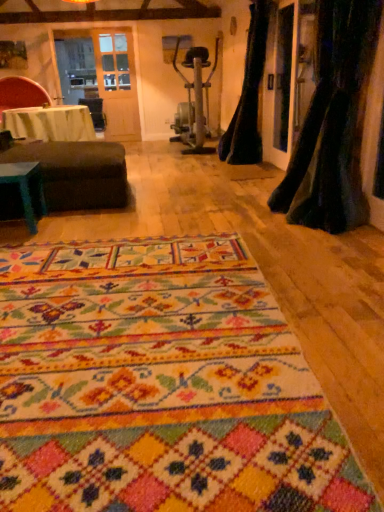
What is the approximate width of multicolored woven rug at center?

The width of multicolored woven rug at center is 7.50 feet.

Describe the element at coordinates (77, 173) in the screenshot. I see `dark brown fabric ottoman at left` at that location.

In the scene shown: What is the approximate width of velvet red chair at upper left?

velvet red chair at upper left is 36.25 inches wide.

Where is `velvet red chair at upper left`? velvet red chair at upper left is located at coordinates (21, 94).

The image size is (384, 512). I want to click on multicolored woven rug at center, so click(160, 388).

Is black velvet curtain at right, which is counted as the first curtain, starting from the front, positioned with its back to velvet red chair at upper left?

No.

Would you say black velvet curtain at right, which is the second curtain from back to front, contains velvet red chair at upper left?

That's incorrect, velvet red chair at upper left is not inside black velvet curtain at right, which is the second curtain from back to front.

From a real-world perspective, who is located lower, black velvet curtain at right, which is counted as the first curtain, starting from the front, or velvet red chair at upper left?

velvet red chair at upper left.

Which is more to the left, velvet red chair at upper left or multicolored woven rug at center?

velvet red chair at upper left.

Is velvet red chair at upper left with multicolored woven rug at center?

No, velvet red chair at upper left is not with multicolored woven rug at center.

Find the location of `chair positioned vertically above the multicolored woven rug at center (from a real-world perspective)`. chair positioned vertically above the multicolored woven rug at center (from a real-world perspective) is located at coordinates (21, 94).

Would you say velvet red chair at upper left is inside or outside multicolored woven rug at center?

velvet red chair at upper left lies outside multicolored woven rug at center.

From a real-world perspective, is white cloth-covered table at left, the 2th table when ordered from bottom to top, above or below dark brown fabric ottoman at left?

Clearly, from a real-world perspective, white cloth-covered table at left, the 2th table when ordered from bottom to top, is above dark brown fabric ottoman at left.

Considering the relative sizes of white cloth-covered table at left, acting as the 2th table starting from the front, and dark brown fabric ottoman at left in the image provided, is white cloth-covered table at left, acting as the 2th table starting from the front, bigger than dark brown fabric ottoman at left?

Correct, white cloth-covered table at left, acting as the 2th table starting from the front, is larger in size than dark brown fabric ottoman at left.

Which is further, (20,116) or (32,150)?

The point (20,116) is behind.

From the picture: Is velvet black curtain at right, which is the 2th curtain from front to back, looking in the opposite direction of multicolored woven rug at center?

velvet black curtain at right, which is the 2th curtain from front to back, is not turned away from multicolored woven rug at center.

From the image's perspective, which one is positioned lower, velvet black curtain at right, which is the 2th curtain from front to back, or multicolored woven rug at center?

multicolored woven rug at center appears lower in the image.

Which object is thinner, velvet black curtain at right, placed as the 1th curtain when sorted from back to front, or multicolored woven rug at center?

Thinner between the two is velvet black curtain at right, placed as the 1th curtain when sorted from back to front.

Is velvet black curtain at right, which is the 2th curtain from front to back, next to multicolored woven rug at center?

velvet black curtain at right, which is the 2th curtain from front to back, is not next to multicolored woven rug at center, and they're not touching.

Between velvet red chair at upper left and black velvet curtain at right, which is the second curtain from back to front, which one is positioned in front?

black velvet curtain at right, which is the second curtain from back to front.

From a real-world perspective, is velvet red chair at upper left located beneath black velvet curtain at right, which is the second curtain from back to front?

Indeed, from a real-world perspective, velvet red chair at upper left is positioned beneath black velvet curtain at right, which is the second curtain from back to front.

Considering the relative positions of velvet red chair at upper left and black velvet curtain at right, which is counted as the first curtain, starting from the front, in the image provided, is velvet red chair at upper left to the left or to the right of black velvet curtain at right, which is counted as the first curtain, starting from the front,?

In the image, velvet red chair at upper left appears on the left side of black velvet curtain at right, which is counted as the first curtain, starting from the front.

Is point (37, 97) closer to camera compared to point (319, 81)?

That is False.

From their relative heights in the image, would you say dark brown fabric ottoman at left is taller or shorter than velvet black curtain at right, placed as the 1th curtain when sorted from back to front?

In the image, dark brown fabric ottoman at left appears to be shorter than velvet black curtain at right, placed as the 1th curtain when sorted from back to front.

Is dark brown fabric ottoman at left facing towards velvet black curtain at right, placed as the 1th curtain when sorted from back to front?

No, dark brown fabric ottoman at left is not oriented towards velvet black curtain at right, placed as the 1th curtain when sorted from back to front.

Is dark brown fabric ottoman at left beside velvet black curtain at right, placed as the 1th curtain when sorted from back to front?

No.

Based on the photo, considering the positions of objects dark brown fabric ottoman at left and velvet black curtain at right, placed as the 1th curtain when sorted from back to front, in the image provided, who is more to the left, dark brown fabric ottoman at left or velvet black curtain at right, placed as the 1th curtain when sorted from back to front,?

dark brown fabric ottoman at left is more to the left.

Considering the sizes of objects velvet black curtain at right, placed as the 1th curtain when sorted from back to front, and white cloth-covered table at left, which ranks as the 1th table in back-to-front order, in the image provided, who is smaller, velvet black curtain at right, placed as the 1th curtain when sorted from back to front, or white cloth-covered table at left, which ranks as the 1th table in back-to-front order,?

white cloth-covered table at left, which ranks as the 1th table in back-to-front order.

In terms of height, does velvet black curtain at right, placed as the 1th curtain when sorted from back to front, look taller or shorter compared to white cloth-covered table at left, acting as the 2th table starting from the front?

velvet black curtain at right, placed as the 1th curtain when sorted from back to front, is taller than white cloth-covered table at left, acting as the 2th table starting from the front.

What's the angular difference between velvet black curtain at right, which is the 2th curtain from front to back, and white cloth-covered table at left, which is the 1th table from top to bottom,'s facing directions?

There is a 179-degree angle between the facing directions of velvet black curtain at right, which is the 2th curtain from front to back, and white cloth-covered table at left, which is the 1th table from top to bottom.

Where is `chair that is behind the black velvet curtain at right, which is the second curtain from back to front`? chair that is behind the black velvet curtain at right, which is the second curtain from back to front is located at coordinates (21, 94).

Find the location of a particular element. mat below the velvet red chair at upper left (from the image's perspective) is located at coordinates (160, 388).

Based on their spatial positions, is multicolored woven rug at center or velvet black curtain at right, which is the 2th curtain from front to back, closer to white cloth-covered table at left, which is the 1th table from top to bottom?

velvet black curtain at right, which is the 2th curtain from front to back, is closer to white cloth-covered table at left, which is the 1th table from top to bottom.

Considering their positions, is white cloth-covered table at left, acting as the 2th table starting from the front, positioned closer to velvet black curtain at right, placed as the 1th curtain when sorted from back to front, than black velvet curtain at right, which is counted as the first curtain, starting from the front?

The object closer to velvet black curtain at right, placed as the 1th curtain when sorted from back to front, is black velvet curtain at right, which is counted as the first curtain, starting from the front.

When comparing their distances from dark brown fabric ottoman at left, does white cloth-covered table at left, which is the 1th table from top to bottom, or velvet red chair at upper left seem further?

The object further to dark brown fabric ottoman at left is velvet red chair at upper left.

Estimate the real-world distances between objects in this image. Which object is closer to green felt table at left, placed as the 2th table when sorted from back to front, multicolored woven rug at center or white cloth-covered table at left, which is the 1th table from top to bottom?

multicolored woven rug at center is positioned closer to the anchor green felt table at left, placed as the 2th table when sorted from back to front.

Considering their positions, is velvet red chair at upper left positioned further to dark brown fabric ottoman at left than black velvet curtain at right, which is the second curtain from back to front?

velvet red chair at upper left is positioned further to the anchor dark brown fabric ottoman at left.

Considering their positions, is multicolored woven rug at center positioned further to dark brown fabric ottoman at left than velvet red chair at upper left?

Among the two, velvet red chair at upper left is located further to dark brown fabric ottoman at left.

Looking at the image, which one is located further to multicolored woven rug at center, green felt table at left, placed as the 2th table when sorted from back to front, or velvet black curtain at right, placed as the 1th curtain when sorted from back to front?

The object further to multicolored woven rug at center is velvet black curtain at right, placed as the 1th curtain when sorted from back to front.

Estimate the real-world distances between objects in this image. Which object is closer to white cloth-covered table at left, which is the 1th table from top to bottom, black velvet curtain at right, which is the second curtain from back to front, or dark brown fabric ottoman at left?

dark brown fabric ottoman at left is positioned closer to the anchor white cloth-covered table at left, which is the 1th table from top to bottom.

I want to click on table located between multicolored woven rug at center and velvet black curtain at right, which is the 2th curtain from front to back, in the depth direction, so click(26, 188).

Where is `studio couch located between green felt table at left, placed as the 2th table when sorted from back to front, and velvet black curtain at right, placed as the 1th curtain when sorted from back to front, in the left-right direction`? Image resolution: width=384 pixels, height=512 pixels. studio couch located between green felt table at left, placed as the 2th table when sorted from back to front, and velvet black curtain at right, placed as the 1th curtain when sorted from back to front, in the left-right direction is located at coordinates (77, 173).

At what (x,y) coordinates should I click in order to perform the action: click on studio couch between white cloth-covered table at left, which is the 1th table from top to bottom, and velvet black curtain at right, placed as the 1th curtain when sorted from back to front, from left to right. Please return your answer as a coordinate pair (x, y). Image resolution: width=384 pixels, height=512 pixels. Looking at the image, I should click on (77, 173).

Locate an element on the screen. The image size is (384, 512). studio couch between green felt table at left, placed as the 2th table when sorted from back to front, and velvet red chair at upper left, along the z-axis is located at coordinates (77, 173).